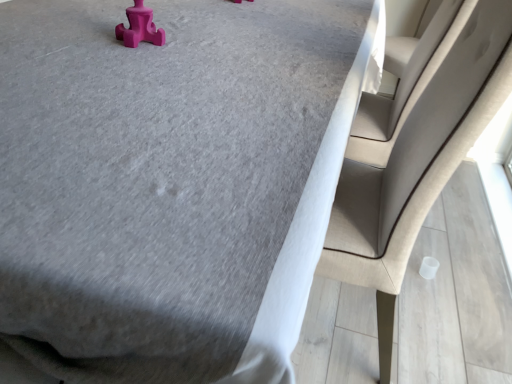
The width and height of the screenshot is (512, 384). I want to click on vacant space in front of pink rubber toy at upper left, so click(115, 63).